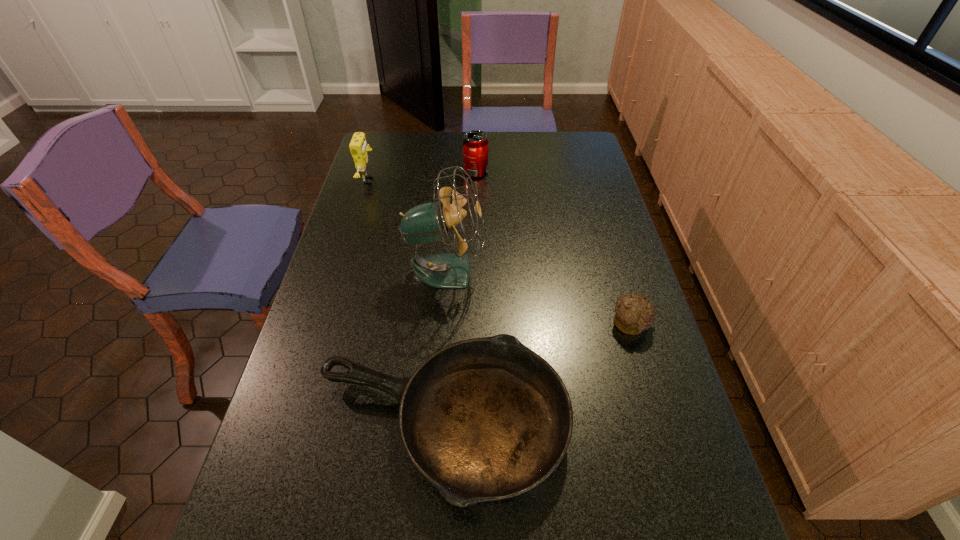
Image resolution: width=960 pixels, height=540 pixels. Find the location of `the third farthest object`. the third farthest object is located at coordinates (429, 222).

Where is `the tallest object`? Image resolution: width=960 pixels, height=540 pixels. the tallest object is located at coordinates (429, 222).

Where is `sponge`? The width and height of the screenshot is (960, 540). sponge is located at coordinates (358, 146).

Where is `soda can`? The height and width of the screenshot is (540, 960). soda can is located at coordinates (475, 145).

Where is `the rightmost object`? the rightmost object is located at coordinates (633, 314).

Image resolution: width=960 pixels, height=540 pixels. I want to click on muffin, so click(633, 314).

Where is `the nearest object`? Image resolution: width=960 pixels, height=540 pixels. the nearest object is located at coordinates (485, 419).

Locate an element on the screen. The width and height of the screenshot is (960, 540). vacant space located on the front-facing side of the third nearest object for air flow is located at coordinates (516, 271).

Where is `vacant region located 0.310m on the face of the sponge`? The height and width of the screenshot is (540, 960). vacant region located 0.310m on the face of the sponge is located at coordinates (461, 180).

Where is `vacant space located 0.100m on the back of the soda can`? This screenshot has height=540, width=960. vacant space located 0.100m on the back of the soda can is located at coordinates (476, 152).